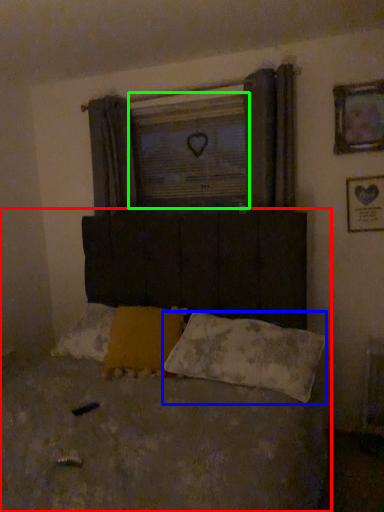
Question: Which object is positioned farthest from bed (highlighted by a red box)? Select from pillow (highlighted by a blue box) and window screen (highlighted by a green box).

Choices:
 (A) pillow
 (B) window screen

Answer: (B)